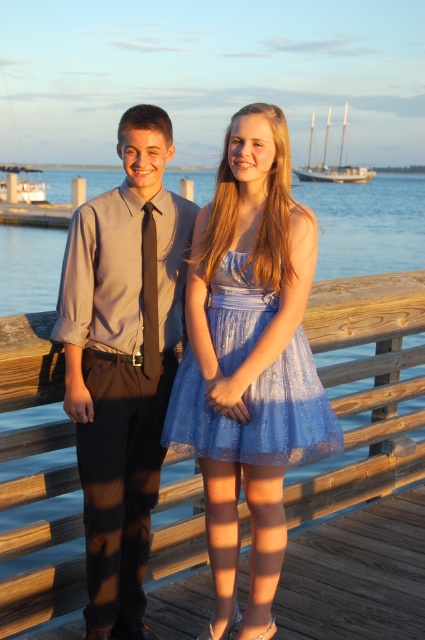
Question: Which point appears closest to the camera in this image?

Choices:
 (A) (229, 422)
 (B) (311, 144)
 (C) (362, 492)
 (D) (204, 440)

Answer: (A)

Question: Is shiny blue tulle dress at center positioned behind matte black tie at center?

Choices:
 (A) no
 (B) yes

Answer: (A)

Question: Which is farther from the matte black tie at center?

Choices:
 (A) white wooden boat at left
 (B) matte gray shirt at center
 (C) white wooden sailboat at upper right
 (D) shiny blue tulle dress at center

Answer: (C)

Question: Is matte black tie at center thinner than white wooden boat at left?

Choices:
 (A) no
 (B) yes

Answer: (B)

Question: Which object appears closest to the camera in this image?

Choices:
 (A) white wooden boat at left
 (B) wooden at center
 (C) matte black tie at center

Answer: (C)

Question: Observing the image, what is the correct spatial positioning of matte gray shirt at center in reference to wooden at center?

Choices:
 (A) above
 (B) below

Answer: (A)